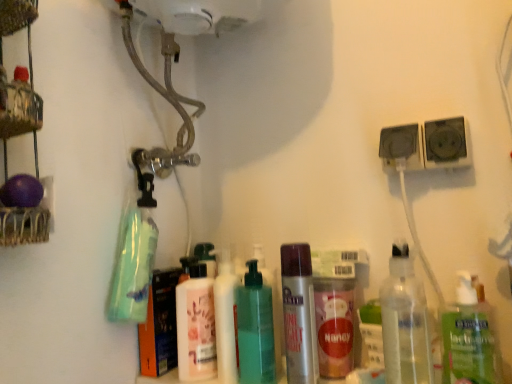
Question: From a real-world perspective, is green matte bottle at left, which ranks as the 2th cleaning product in right-to-left order, on top of clear plastic bottle at center-right, the second bottle in the right-to-left sequence?

Choices:
 (A) no
 (B) yes

Answer: (B)

Question: Is green matte bottle at left, which ranks as the 2th cleaning product in right-to-left order, positioned before clear plastic bottle at center-right, the second bottle in the right-to-left sequence?

Choices:
 (A) no
 (B) yes

Answer: (A)

Question: From a real-world perspective, is green matte bottle at left, arranged as the 1th cleaning product when viewed from the left, below clear plastic bottle at center-right, the second bottle in the right-to-left sequence?

Choices:
 (A) yes
 (B) no

Answer: (B)

Question: Is green matte bottle at left, which ranks as the 2th cleaning product in right-to-left order, taller than clear plastic bottle at center-right, the second bottle in the right-to-left sequence?

Choices:
 (A) no
 (B) yes

Answer: (A)

Question: Could clear plastic bottle at center-right, the fourth bottle in the left-to-right sequence, be considered to be inside green matte bottle at left, which ranks as the 2th cleaning product in right-to-left order?

Choices:
 (A) no
 (B) yes

Answer: (A)

Question: Is green matte bottle at left, which ranks as the 2th cleaning product in right-to-left order, bigger than clear plastic bottle at center-right, the second bottle in the right-to-left sequence?

Choices:
 (A) no
 (B) yes

Answer: (B)

Question: Can we say clear plastic bottle at lower right, which is the 5th bottle from left to right, lies outside clear plastic bottle at center-right, the second bottle in the right-to-left sequence?

Choices:
 (A) yes
 (B) no

Answer: (A)

Question: Can you confirm if clear plastic bottle at lower right, which is the 5th bottle from left to right, is positioned to the left of clear plastic bottle at center-right, the fourth bottle in the left-to-right sequence?

Choices:
 (A) yes
 (B) no

Answer: (B)

Question: From a real-world perspective, does clear plastic bottle at lower right, positioned as the first bottle in right-to-left order, stand above clear plastic bottle at center-right, the fourth bottle in the left-to-right sequence?

Choices:
 (A) yes
 (B) no

Answer: (B)

Question: Does clear plastic bottle at lower right, which is the 5th bottle from left to right, have a larger size compared to clear plastic bottle at center-right, the second bottle in the right-to-left sequence?

Choices:
 (A) no
 (B) yes

Answer: (A)

Question: Considering the relative positions of clear plastic bottle at lower right, which is the 5th bottle from left to right, and clear plastic bottle at center-right, the second bottle in the right-to-left sequence, in the image provided, is clear plastic bottle at lower right, which is the 5th bottle from left to right, behind clear plastic bottle at center-right, the second bottle in the right-to-left sequence,?

Choices:
 (A) yes
 (B) no

Answer: (A)

Question: From a real-world perspective, is clear plastic bottle at lower right, positioned as the first bottle in right-to-left order, under clear plastic bottle at center-right, the fourth bottle in the left-to-right sequence?

Choices:
 (A) no
 (B) yes

Answer: (B)

Question: Is clear plastic bottle at lower right, positioned as the first bottle in right-to-left order, wider than green matte bottle at left, arranged as the 1th cleaning product when viewed from the left?

Choices:
 (A) no
 (B) yes

Answer: (A)